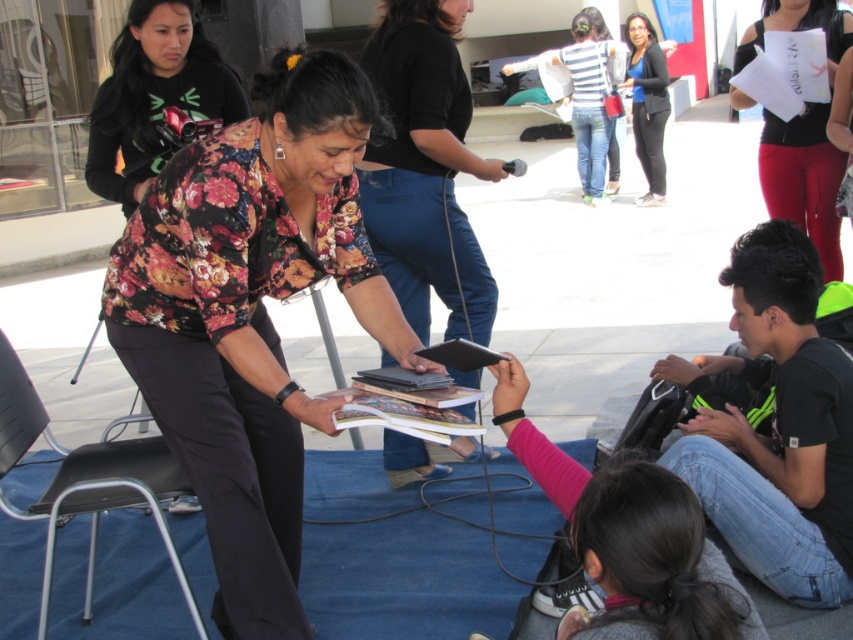
Is the position of floral fabric shirt at center less distant than that of black jersey at upper right?

Yes.

Does floral fabric shirt at center have a greater height compared to black jersey at upper right?

No.

Describe the element at coordinates (425, 170) in the screenshot. The image size is (853, 640). I see `floral fabric shirt at center` at that location.

Where is `floral fabric shirt at center`? This screenshot has width=853, height=640. floral fabric shirt at center is located at coordinates (425, 170).

Is black plastic chair at lower left wider than striped fabric shirt at upper center?

In fact, black plastic chair at lower left might be narrower than striped fabric shirt at upper center.

Does point (144, 451) come farther from viewer compared to point (576, 100)?

No.

Which is in front, point (93, 483) or point (589, 124)?

Point (93, 483)

Locate an element on the screen. black plastic chair at lower left is located at coordinates (85, 481).

Can you confirm if floral fabric shirt at center is smaller than pink fleece sweater at lower center?

No.

Which is above, floral fabric shirt at center or pink fleece sweater at lower center?

floral fabric shirt at center

This screenshot has height=640, width=853. I want to click on floral fabric shirt at center, so pos(425,170).